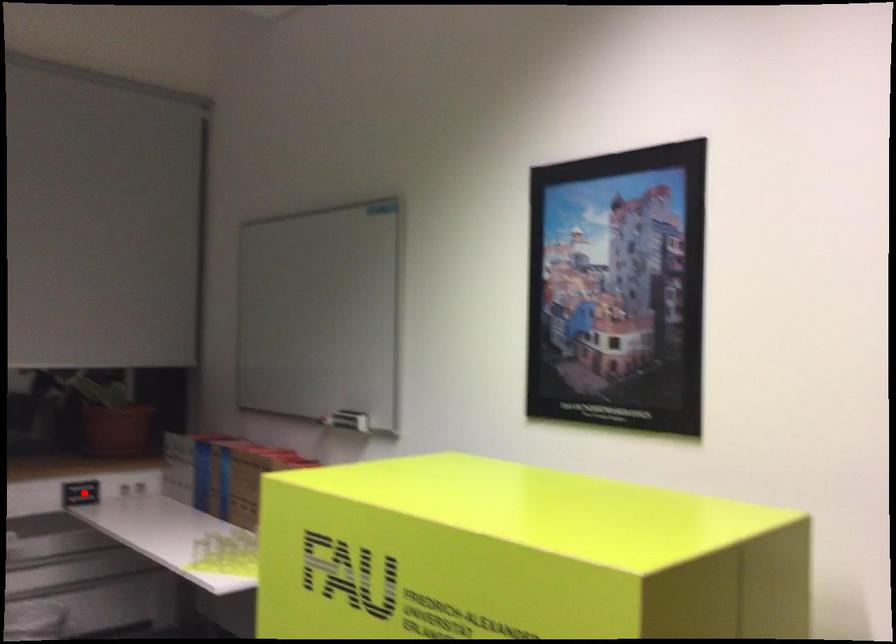
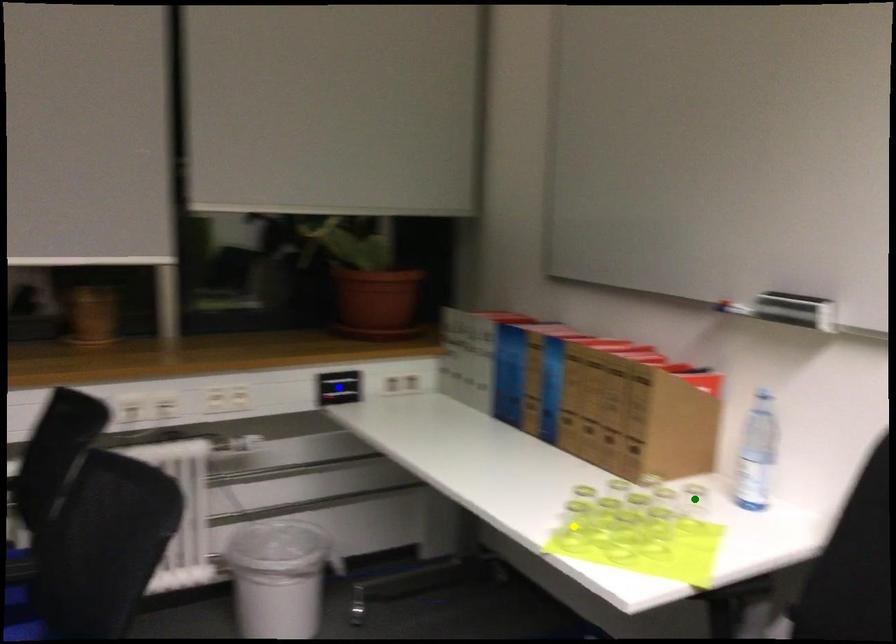
Question: I am providing you with two images of the same scene from different viewpoints. A red point is marked on the first image. You are given multiple points on the second image. In image 2, which mark is for the same physical point as the one in image 1?

Choices:
 (A) green point
 (B) blue point
 (C) yellow point

Answer: (B)